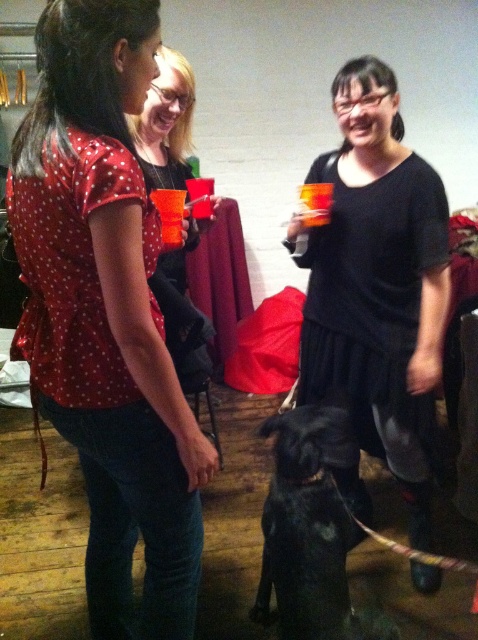
Question: Does black matte dress at center appear on the left side of matte black dress at center?

Choices:
 (A) yes
 (B) no

Answer: (B)

Question: Which point is closer to the camera taking this photo?

Choices:
 (A) (99, 17)
 (B) (184, 61)

Answer: (A)

Question: Can you confirm if matte red blouse at center is positioned to the left of black matte dog at center?

Choices:
 (A) no
 (B) yes

Answer: (B)

Question: Which point is closer to the camera?

Choices:
 (A) matte red blouse at center
 (B) matte black dress at center

Answer: (A)

Question: Does black matte dress at center lie in front of matte black dress at center?

Choices:
 (A) yes
 (B) no

Answer: (A)

Question: Estimate the real-world distances between objects in this image. Which object is farther from the matte black dress at center?

Choices:
 (A) matte red blouse at center
 (B) black matte dog at center

Answer: (B)